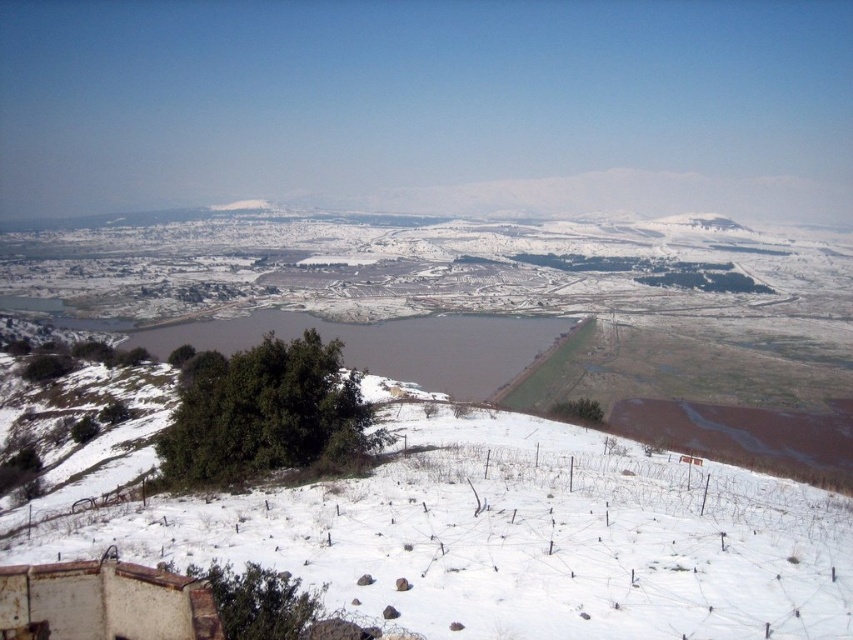
You are standing at the snow covered hill in the foreground and want to walk to the large body of water in the middle ground. There are two points marked on your path. Which point should you reach first, point (621, 570) or point (503, 349)?

You should reach point (621, 570) first because it is in front of point (503, 349) along your path to the large body of water.

You are standing at the bottom of the snow covered hill and want to walk towards the white powdery snow at center. Which direction should you walk?

The white powdery snow at center is located at point (515, 538) in the image, so you should walk towards the center of the image.